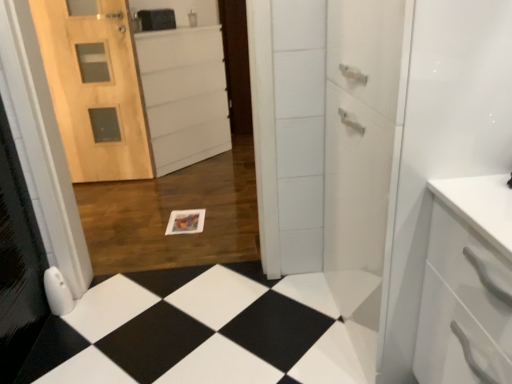
The height and width of the screenshot is (384, 512). I want to click on free space in front of white matte cabinet at center, so click(x=170, y=185).